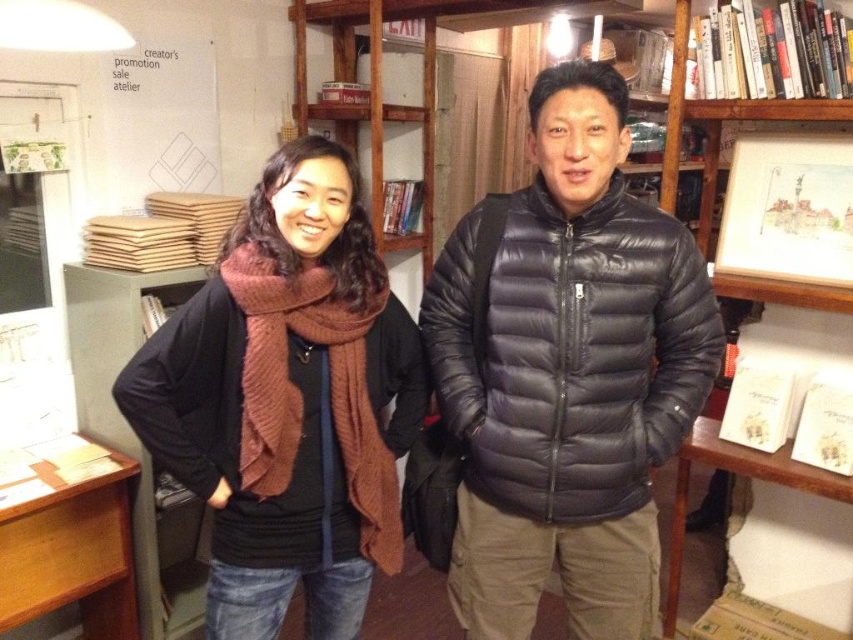
You are a photographer trying to capture a photo of the matte black jacket at center and the brown knitted scarf at center. If you want to ensure both items are in focus, which one requires you to adjust the camera focus to a closer distance?

The matte black jacket at center requires adjusting the camera focus to a closer distance because it is wider than the brown knitted scarf at center, necessitating a closer focus for sharpness.

You are a photographer setting up a shoot in this bookstore. You want to ensure the matte black jacket at center and the green metal cabinet at left are both visible in the frame. Based on their positions, which object is closer to the camera?

The matte black jacket at center is closer to the camera than the green metal cabinet at left because it is in front of it.

You are trying to determine which item is taller between the matte black jacket at center and the brown knitted scarf at center. Based on the scene, which one has a greater height?

The matte black jacket at center has a greater height compared to the brown knitted scarf at center.